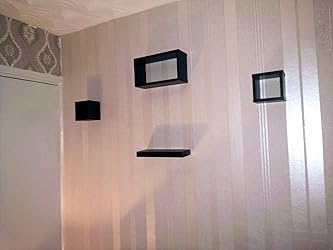
Where is `shelf`? This screenshot has height=250, width=333. shelf is located at coordinates (168, 152).